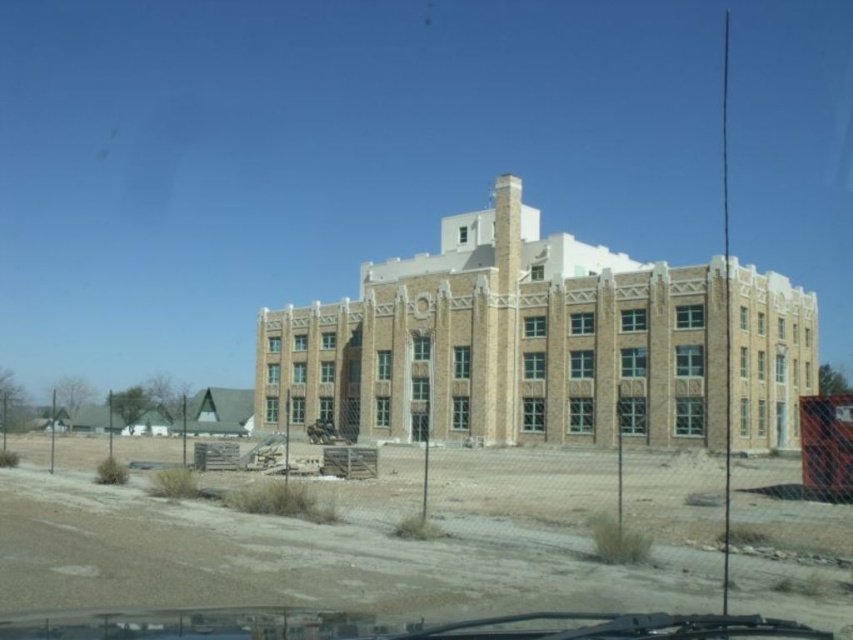
You are a construction worker assessing the site of a potential new project. You notice a dirt field at lower left and a beige brick building at center. Which of these two features has a greater height?

The beige brick building at center is taller than the dirt field at lower left.

You are standing in a park and see a dirt field at lower left and a beige brick building at center. Which object is nearer to you?

The dirt field at lower left is closer to the viewer than the beige brick building at center.